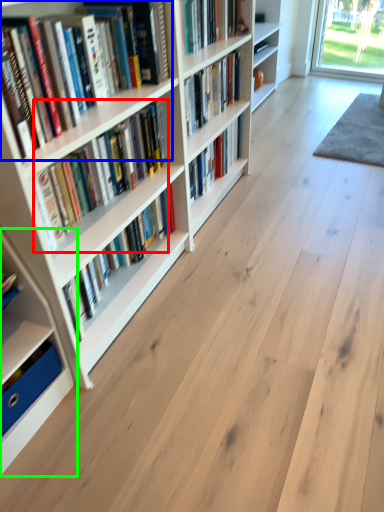
Question: Which object is the farthest from book (highlighted by a red box)? Choose among these: book (highlighted by a blue box) or shelf (highlighted by a green box).

Choices:
 (A) book
 (B) shelf

Answer: (B)